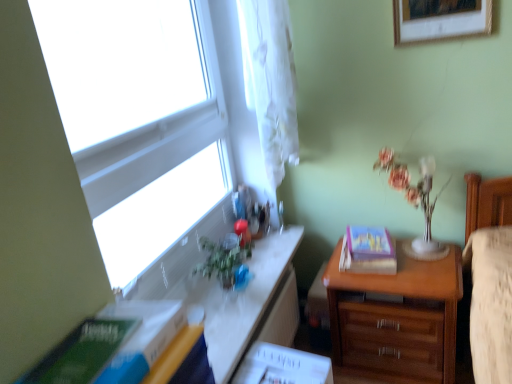
Where is `free spot in front of hardcover book at right, arranged as the 2th paperback book when viewed from the left`? The height and width of the screenshot is (384, 512). free spot in front of hardcover book at right, arranged as the 2th paperback book when viewed from the left is located at coordinates (403, 276).